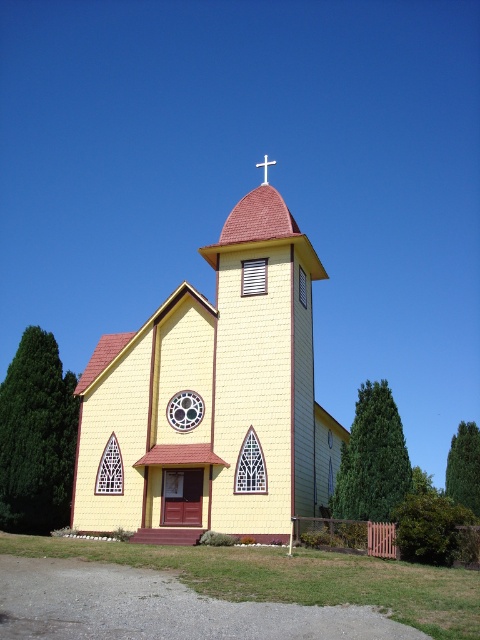
You are standing in front of the church and notice the metallic circular clock at center and the white metallic cross at upper center. Which object appears narrower when viewed from your current position?

The metallic circular clock at center has a lesser width compared to the white metallic cross at upper center, so it appears narrower.

From the picture: You are standing in front of the church and want to check the time. Where is the metallic circular clock at center located?

The metallic circular clock at center is located at point (184,410).

You are standing in front of the church and want to enter through the main entrance. Which object, the yellow wood chapel at center or the white metallic cross at upper center, is closer to you as you approach the building?

The yellow wood chapel at center is closer to you than the white metallic cross at upper center because the chapel is located below the cross, meaning the cross is positioned higher up on the building.